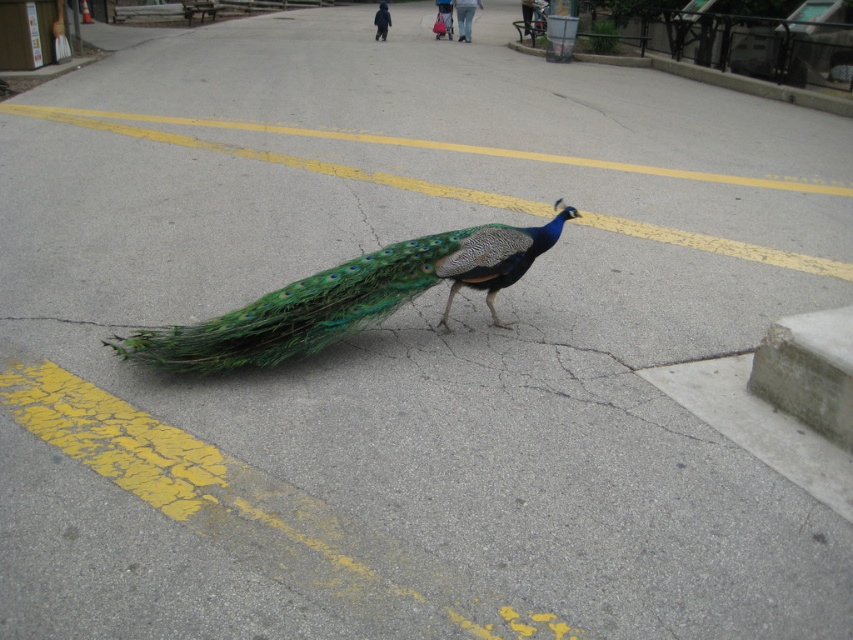
Question: Can you confirm if green iridescent peacock at center is wider than gray concrete curb at upper right?

Choices:
 (A) no
 (B) yes

Answer: (B)

Question: Among these points, which one is nearest to the camera?

Choices:
 (A) (392, 294)
 (B) (773, 92)

Answer: (A)

Question: Can you confirm if green iridescent peacock at center is positioned to the right of gray concrete curb at upper right?

Choices:
 (A) no
 (B) yes

Answer: (A)

Question: Can you confirm if green iridescent peacock at center is bigger than gray concrete curb at upper right?

Choices:
 (A) no
 (B) yes

Answer: (B)

Question: Among these points, which one is nearest to the camera?

Choices:
 (A) (190, 353)
 (B) (795, 96)

Answer: (A)